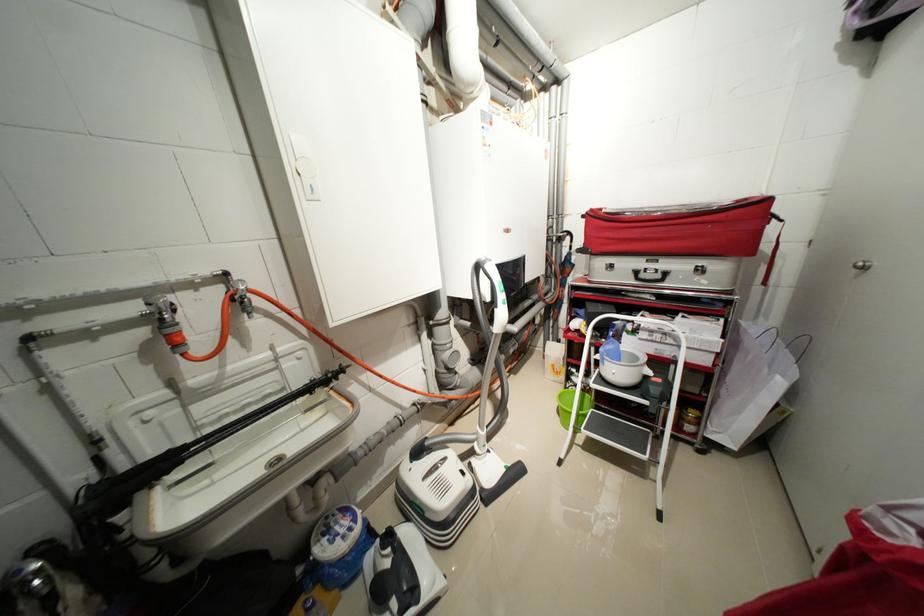
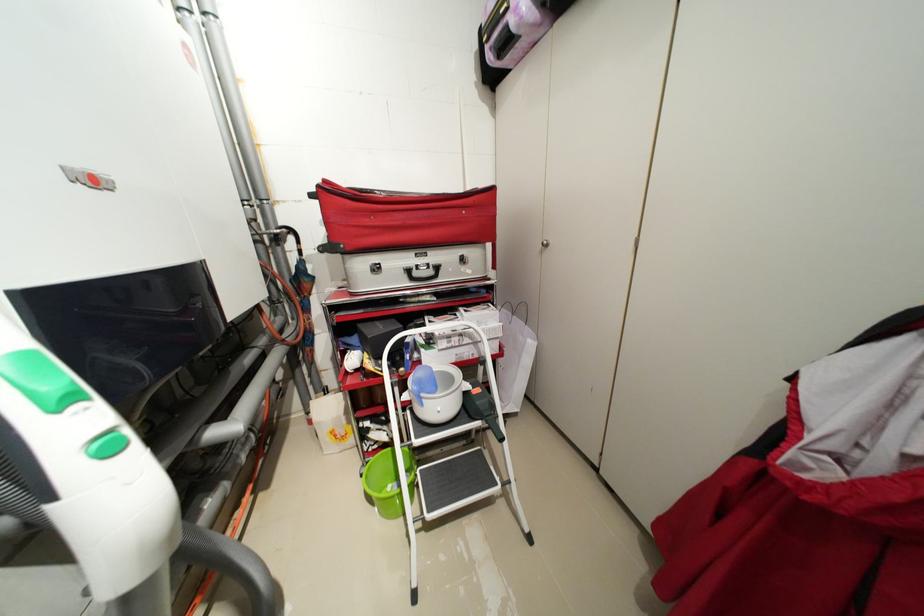
Question: The images are taken continuously from a first-person perspective. In which direction is your viewpoint rotating?

Choices:
 (A) Left
 (B) Right
 (C) Up
 (D) Down

Answer: (B)